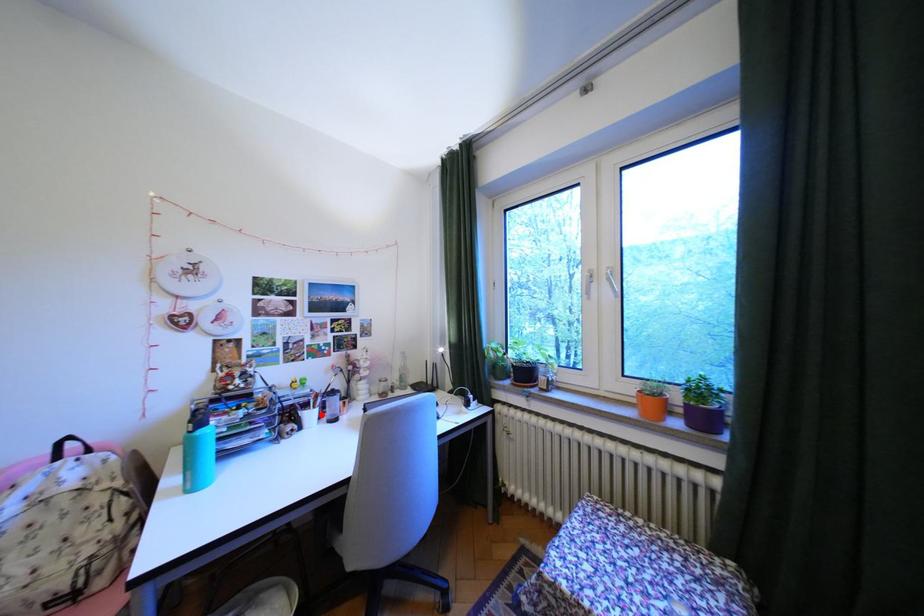
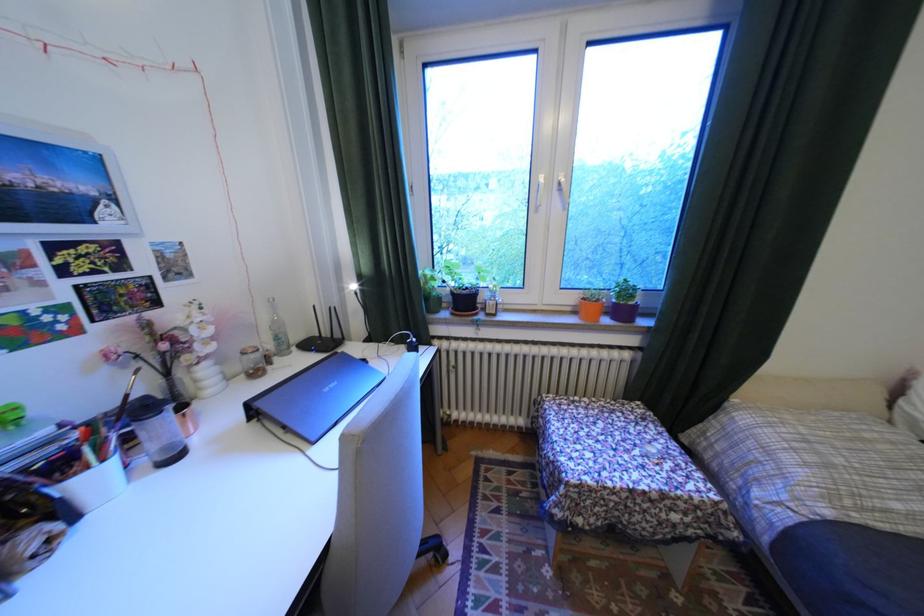
In the second image, find the point that corresponds to the highlighted location in the first image.

(106, 479)